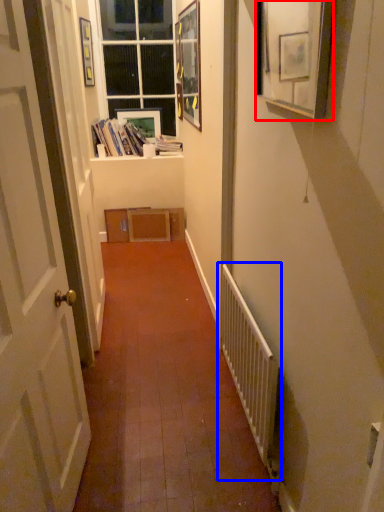
Question: Among these objects, which one is farthest to the camera, picture frame (highlighted by a red box) or radiator (highlighted by a blue box)?

Choices:
 (A) picture frame
 (B) radiator

Answer: (B)